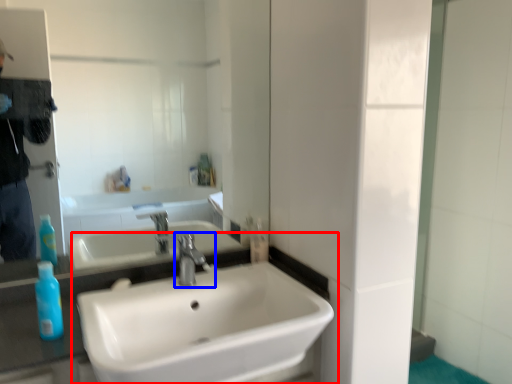
Question: Which of the following is the closest to the observer, sink (highlighted by a red box) or tap (highlighted by a blue box)?

Choices:
 (A) sink
 (B) tap

Answer: (A)